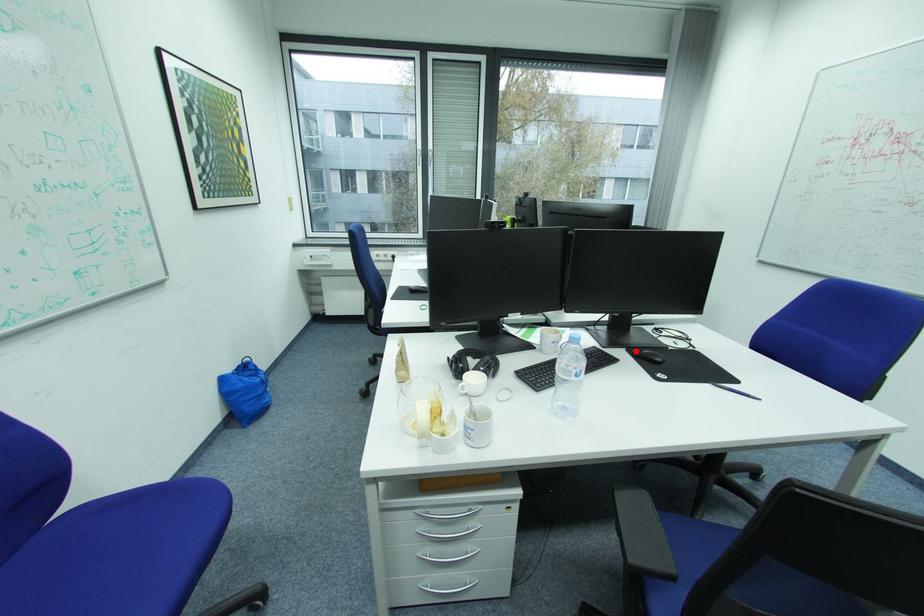
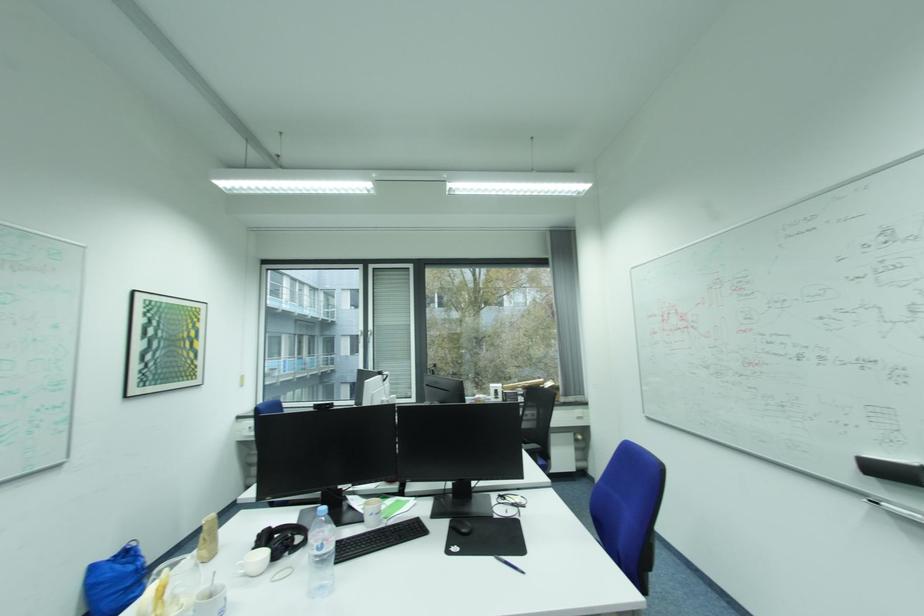
Locate, in the second image, the point that corresponds to the highlighted location in the first image.

(458, 522)